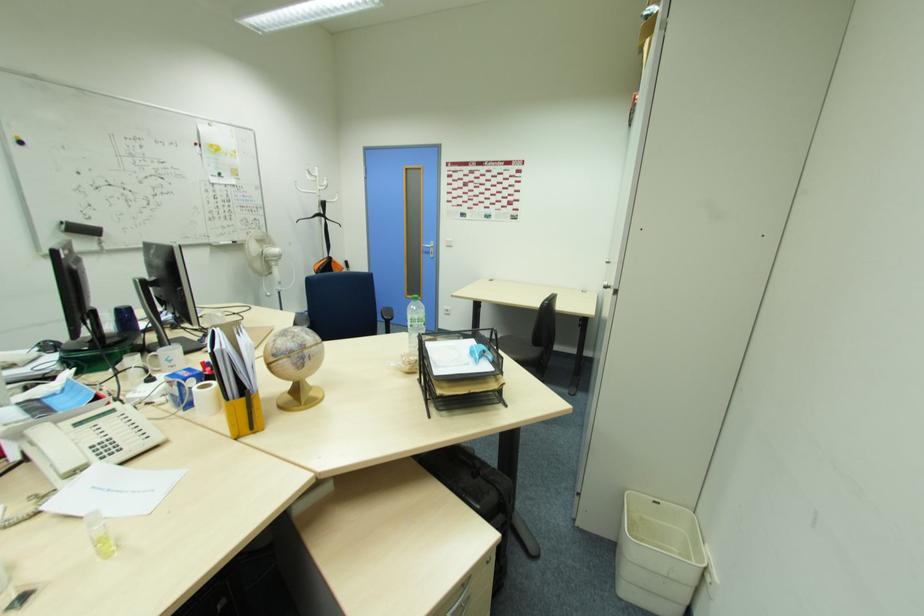
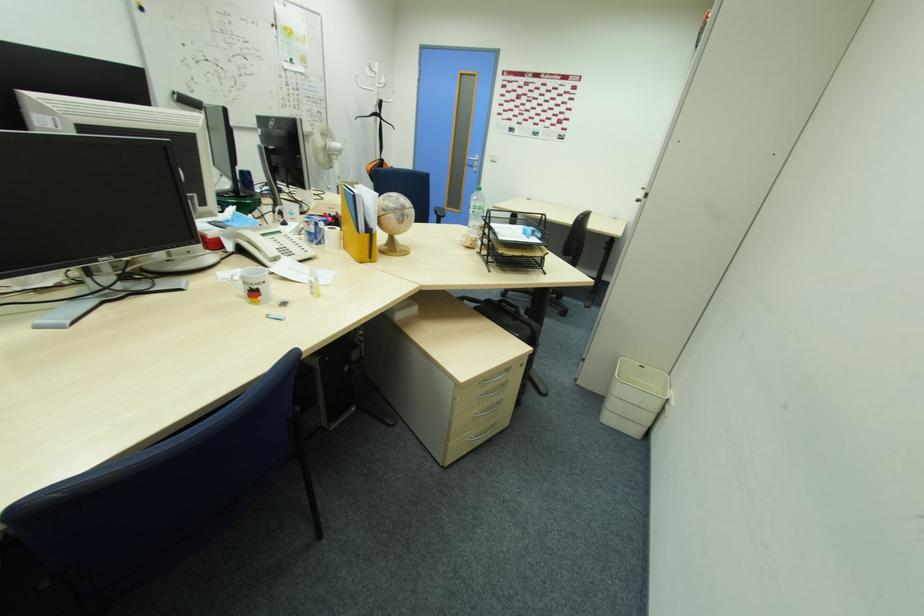
Question: The images are taken continuously from a first-person perspective. In which direction is your viewpoint rotating?

Choices:
 (A) Left
 (B) Right
 (C) Up
 (D) Down

Answer: (D)